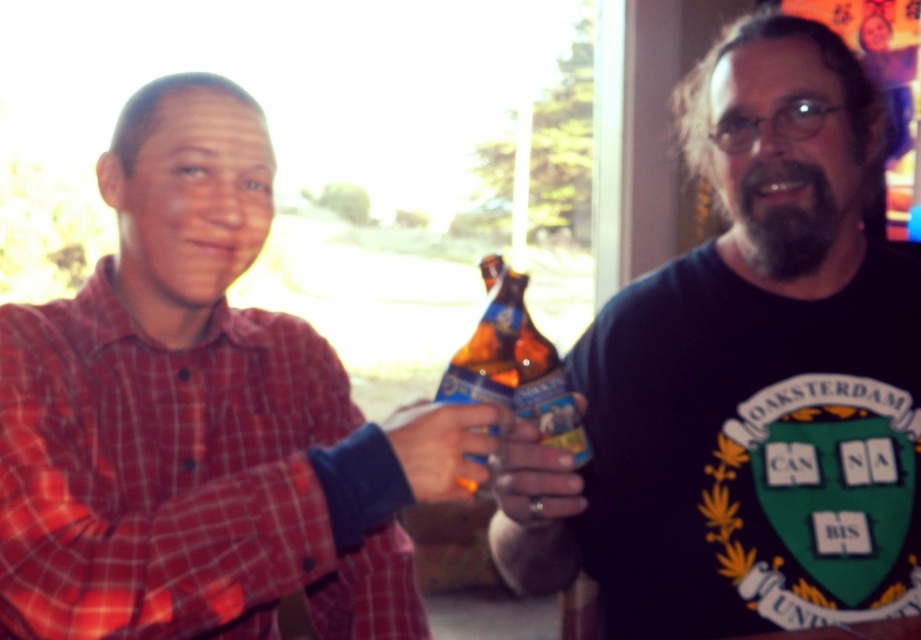
Consider the image. Does matte plastic ring at center lie behind translucent glass bottle at center?

No, matte plastic ring at center is in front of translucent glass bottle at center.

Which is more to the left, matte plastic ring at center or translucent glass bottle at center?

From the viewer's perspective, matte plastic ring at center appears more on the left side.

Between point (459, 477) and point (583, 429), which one is positioned behind?

The point (583, 429) is more distant.

Where is `matte plastic ring at center`? matte plastic ring at center is located at coordinates (442, 445).

Who is more distant from viewer, [800,65] or [406,419]?

Point [800,65]

Does black matte t-shirt at center have a smaller size compared to matte plastic ring at center?

Incorrect, black matte t-shirt at center is not smaller in size than matte plastic ring at center.

Find the location of a particular element. black matte t-shirt at center is located at coordinates (754, 378).

Where is `black matte t-shirt at center`? Image resolution: width=921 pixels, height=640 pixels. black matte t-shirt at center is located at coordinates (754, 378).

How far apart are black matte t-shirt at center and matte plastic beer bottle at center?

25.89 centimeters

From the picture: Who is lower down, black matte t-shirt at center or matte plastic beer bottle at center?

matte plastic beer bottle at center is below.

Identify the location of black matte t-shirt at center. (754, 378).